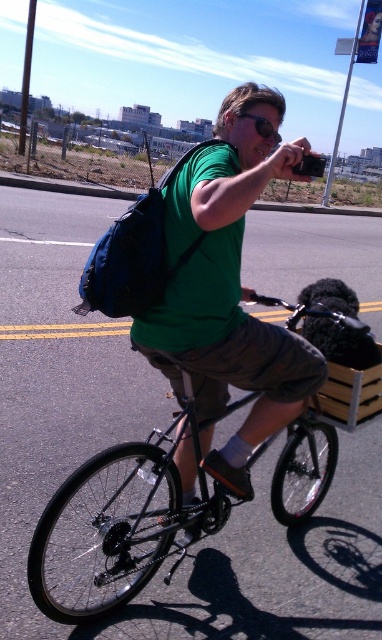
Is point (213, 211) more distant than point (166, 518)?

No, (213, 211) is in front of (166, 518).

Which is more to the left, green matte shirt at center or black matte bicycle at center?

black matte bicycle at center

Is point (233, 253) positioned after point (351, 419)?

No, it is in front of (351, 419).

The width and height of the screenshot is (382, 640). Find the location of `green matte shirt at center`. green matte shirt at center is located at coordinates (228, 288).